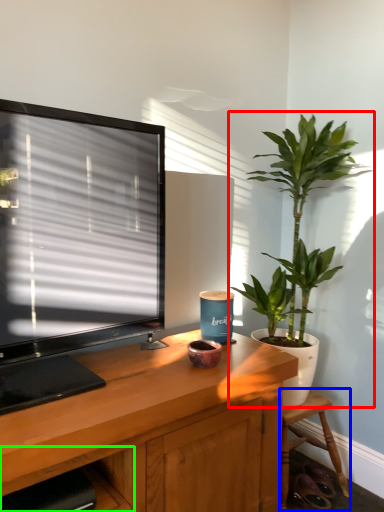
Question: Considering the real-world distances, which object is farthest from houseplant (highlighted by a red box)? chair (highlighted by a blue box) or shelf (highlighted by a green box)?

Choices:
 (A) chair
 (B) shelf

Answer: (B)